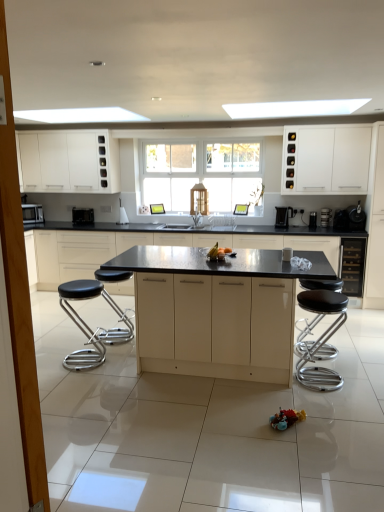
Question: Is matte black countertop at center, which is the third cabinetry from back to front, thinner than black chrome bar stool at right, positioned as the 2th bar stool in left-to-right order?

Choices:
 (A) no
 (B) yes

Answer: (A)

Question: Is black chrome bar stool at right, positioned as the 2th bar stool in left-to-right order, surrounded by matte black countertop at center, which is the third cabinetry from back to front?

Choices:
 (A) no
 (B) yes

Answer: (A)

Question: Is matte black countertop at center, the fourth cabinetry positioned from the front, aimed at black chrome bar stool at right, arranged as the first bar stool when viewed from the right?

Choices:
 (A) yes
 (B) no

Answer: (A)

Question: From a real-world perspective, is matte black countertop at center, which is the third cabinetry from back to front, physically below black chrome bar stool at right, arranged as the first bar stool when viewed from the right?

Choices:
 (A) yes
 (B) no

Answer: (B)

Question: From a real-world perspective, is matte black countertop at center, the fourth cabinetry positioned from the front, physically above black chrome bar stool at right, positioned as the 2th bar stool in left-to-right order?

Choices:
 (A) yes
 (B) no

Answer: (A)

Question: Is black chrome bar stool at right, positioned as the 2th bar stool in left-to-right order, at the back of matte black countertop at center, the fourth cabinetry positioned from the front?

Choices:
 (A) no
 (B) yes

Answer: (A)

Question: From a real-world perspective, is black glass wine cooler at right, which is the second cabinetry from back to front, under black chrome bar stool at right, arranged as the first bar stool when viewed from the right?

Choices:
 (A) no
 (B) yes

Answer: (A)

Question: Can you confirm if black glass wine cooler at right, the fifth cabinetry from the front, is smaller than black chrome bar stool at right, arranged as the first bar stool when viewed from the right?

Choices:
 (A) no
 (B) yes

Answer: (A)

Question: Considering the relative positions of black glass wine cooler at right, the fifth cabinetry from the front, and black chrome bar stool at right, arranged as the first bar stool when viewed from the right, in the image provided, is black glass wine cooler at right, the fifth cabinetry from the front, to the left of black chrome bar stool at right, arranged as the first bar stool when viewed from the right, from the viewer's perspective?

Choices:
 (A) yes
 (B) no

Answer: (B)

Question: Can you confirm if black glass wine cooler at right, which is the second cabinetry from back to front, is bigger than black chrome bar stool at right, positioned as the 2th bar stool in left-to-right order?

Choices:
 (A) yes
 (B) no

Answer: (A)

Question: Is black glass wine cooler at right, the fifth cabinetry from the front, far away from black chrome bar stool at right, positioned as the 2th bar stool in left-to-right order?

Choices:
 (A) no
 (B) yes

Answer: (B)

Question: Is black glass wine cooler at right, the fifth cabinetry from the front, oriented towards black chrome bar stool at right, arranged as the first bar stool when viewed from the right?

Choices:
 (A) no
 (B) yes

Answer: (B)

Question: Can you confirm if matte black countertop at center, the fourth cabinetry positioned from the front, is thinner than black plastic coffee machine at right, placed as the second coffee machine when sorted from left to right?

Choices:
 (A) yes
 (B) no

Answer: (B)